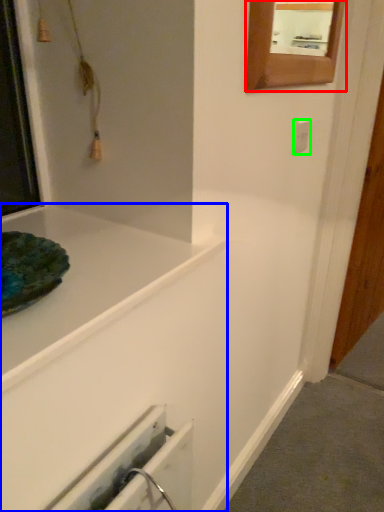
Question: Considering the real-world distances, which object is farthest from mirror (highlighted by a red box)? bathtub (highlighted by a blue box) or electric outlet (highlighted by a green box)?

Choices:
 (A) bathtub
 (B) electric outlet

Answer: (A)